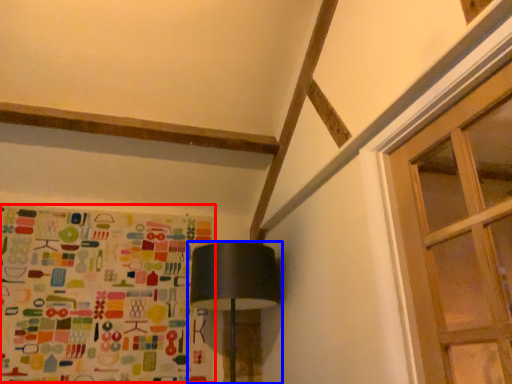
Question: Which object appears closest to the camera in this image, print (highlighted by a red box) or lamp (highlighted by a blue box)?

Choices:
 (A) print
 (B) lamp

Answer: (B)